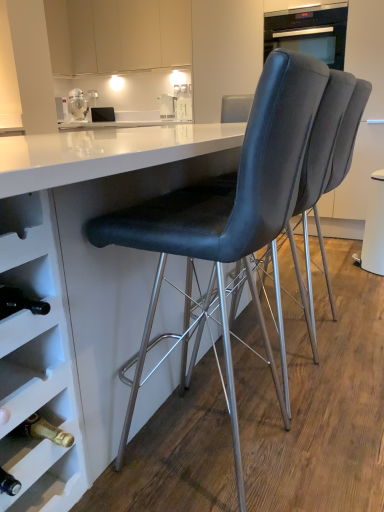
You are a GUI agent. You are given a task and a screenshot of the screen. Output one action in this format:
    pyautogui.click(x=<x>, y=<y>)
    Task: Click on the free point to the right of matte black chair at center, the 1th chair from the front
    The image size is (384, 512).
    Given the screenshot: What is the action you would take?
    pyautogui.click(x=347, y=440)